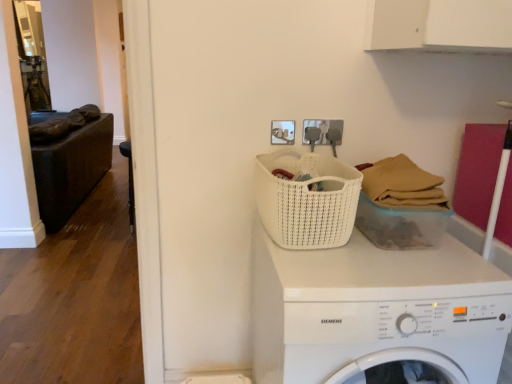
I want to click on free space above white plastic washing machine at center (from a real-world perspective), so click(x=382, y=255).